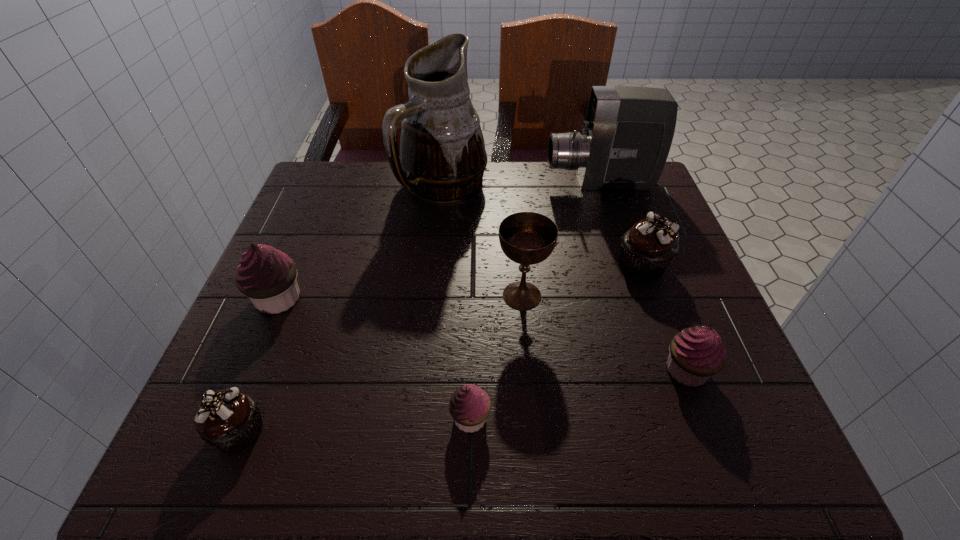
This screenshot has height=540, width=960. In order to click on vacant area located 0.400m on the left of the bigger brown cupcake in this screenshot , I will do `click(431, 265)`.

In order to click on free location located 0.070m on the front of the second nearest pink cupcake in this screenshot , I will do `click(710, 433)`.

I want to click on free space located on the back of the nearest pink cupcake, so click(x=471, y=345).

At what (x,y) coordinates should I click in order to perform the action: click on vacant space located 0.240m on the right of the nearer brown cupcake. Please return your answer as a coordinate pair (x, y). Looking at the image, I should click on (419, 430).

Where is `pitcher located at the far edge`? pitcher located at the far edge is located at coordinates (442, 159).

At what (x,y) coordinates should I click in order to perform the action: click on camcorder that is at the far edge. Please return your answer as a coordinate pair (x, y). Looking at the image, I should click on (626, 137).

At what (x,y) coordinates should I click in order to perform the action: click on camcorder that is at the right edge. Please return your answer as a coordinate pair (x, y). Looking at the image, I should click on (626, 137).

This screenshot has height=540, width=960. What are the coordinates of `object that is at the near left corner` in the screenshot? It's located at (230, 420).

Find the location of a particular element. The image size is (960, 540). object that is at the far right corner is located at coordinates [x=626, y=137].

Where is `vacant area at the far edge of the desktop`? The image size is (960, 540). vacant area at the far edge of the desktop is located at coordinates (504, 210).